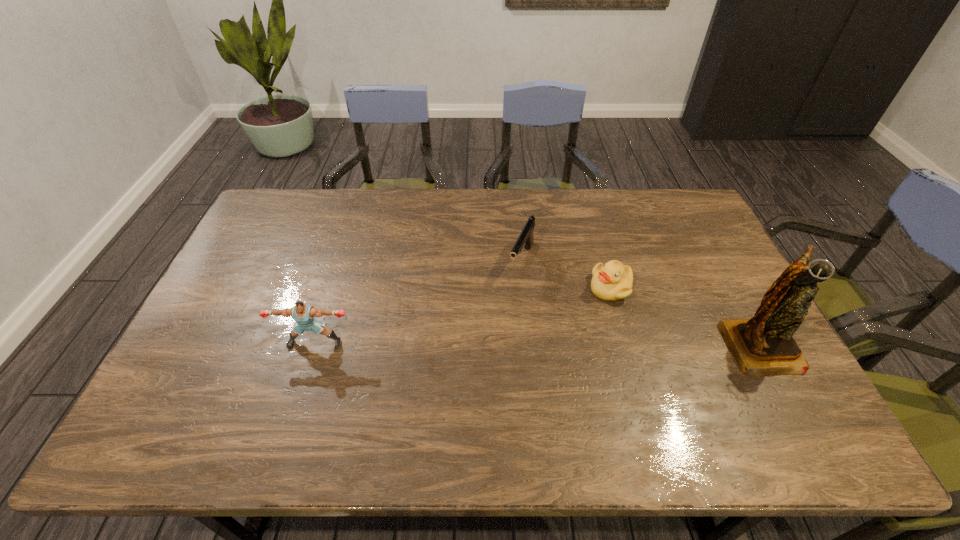
The width and height of the screenshot is (960, 540). What are the coordinates of `free region located 0.190m on the front-facing side of the third object from left to right` in the screenshot? It's located at (580, 349).

This screenshot has width=960, height=540. I want to click on free space located on the front-facing side of the third object from left to right, so click(569, 369).

You are a GUI agent. You are given a task and a screenshot of the screen. Output one action in this format:
    pyautogui.click(x=<x>, y=<y>)
    Task: Click on the free space located on the front-facing side of the third object from left to right
    
    Given the screenshot: What is the action you would take?
    pyautogui.click(x=589, y=331)

Find the location of a particular element. The image size is (960, 540). object located at the near edge is located at coordinates (762, 346).

At what (x,y) coordinates should I click in order to perform the action: click on object that is at the right edge. Please return your answer as a coordinate pair (x, y). Looking at the image, I should click on (762, 346).

Identify the location of object situated at the near right corner. (762, 346).

Find the location of a particular element. free space at the far edge of the desktop is located at coordinates (427, 225).

The image size is (960, 540). Find the location of `vacant area at the near edge`. vacant area at the near edge is located at coordinates (690, 383).

Identify the location of free space at the left edge. The image size is (960, 540). (216, 307).

At what (x,y) coordinates should I click in order to perform the action: click on free region at the right edge of the desktop. Please return your answer as a coordinate pair (x, y). Looking at the image, I should click on click(x=728, y=292).